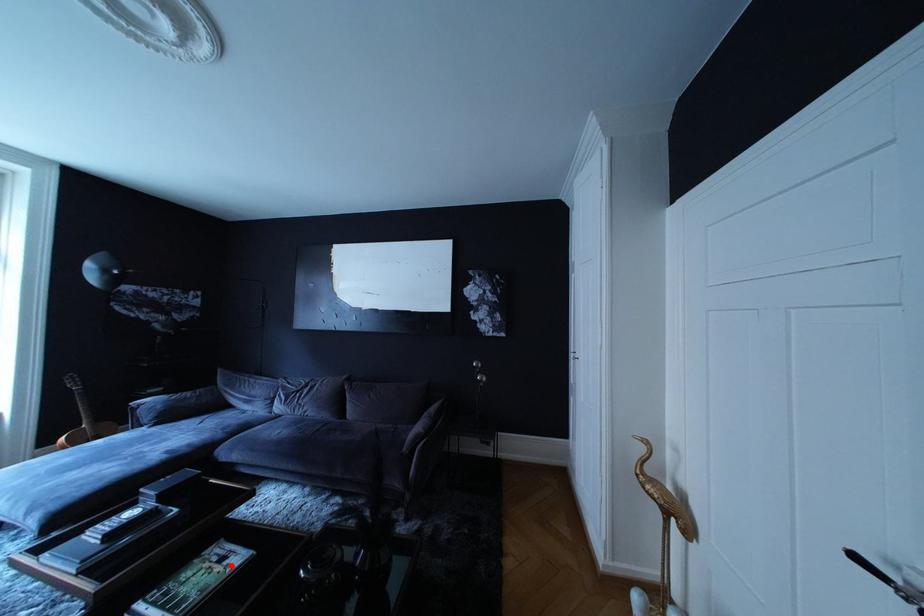
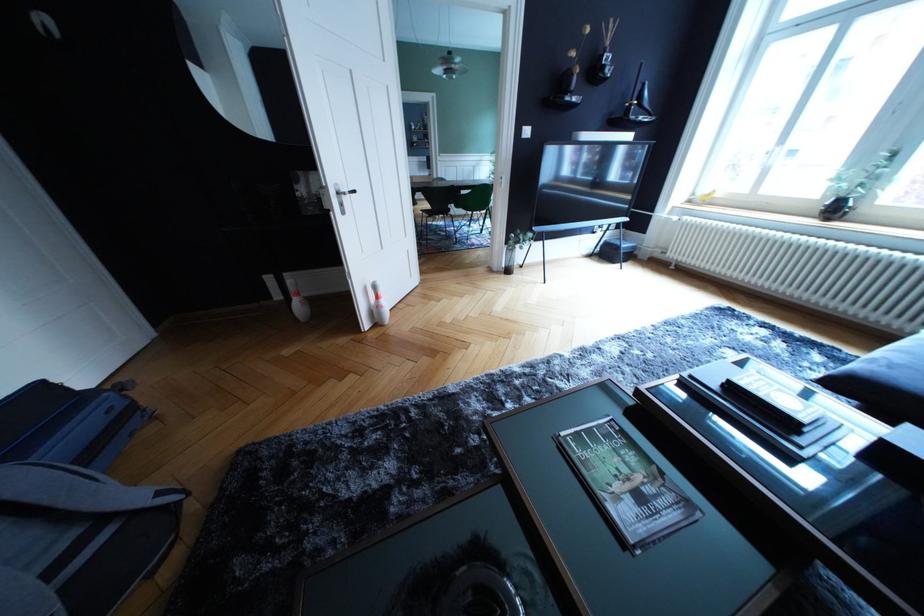
The point at the highlighted location is marked in the first image. Where is the corresponding point in the second image?

(649, 504)